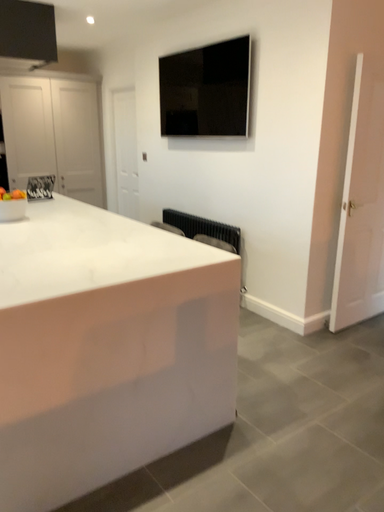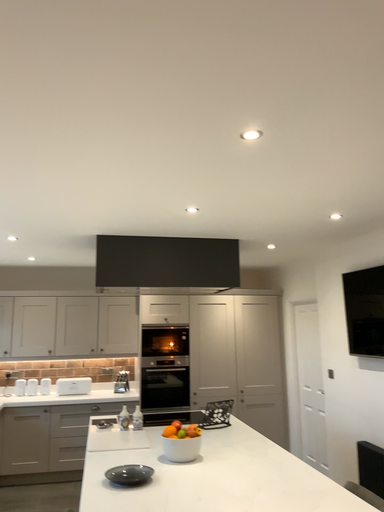
Question: Which way did the camera rotate in the video?

Choices:
 (A) rotated left
 (B) rotated right

Answer: (A)